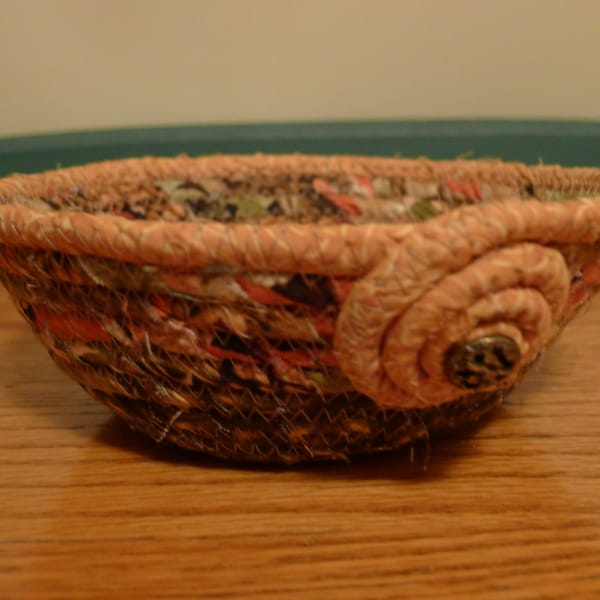
In order to click on wooden table in this screenshot , I will do `click(299, 530)`.